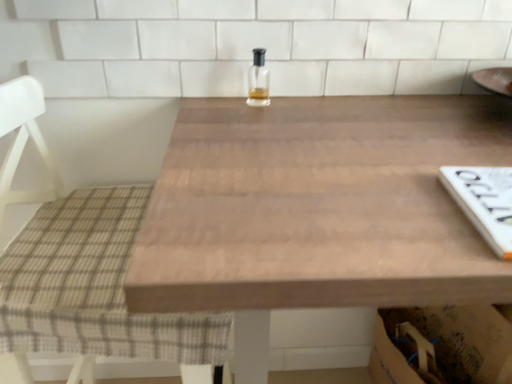
Question: Is wooden table at center facing towards clear glass bottle at center?

Choices:
 (A) yes
 (B) no

Answer: (B)

Question: Is the surface of wooden table at center in direct contact with clear glass bottle at center?

Choices:
 (A) yes
 (B) no

Answer: (B)

Question: Is wooden table at center further to the viewer compared to clear glass bottle at center?

Choices:
 (A) no
 (B) yes

Answer: (A)

Question: Is wooden table at center positioned in front of clear glass bottle at center?

Choices:
 (A) no
 (B) yes

Answer: (B)

Question: From the image's perspective, is wooden table at center below clear glass bottle at center?

Choices:
 (A) yes
 (B) no

Answer: (A)

Question: Does wooden table at center have a lesser height compared to clear glass bottle at center?

Choices:
 (A) yes
 (B) no

Answer: (B)

Question: Does clear glass bottle at center have a lesser width compared to plaid fabric chair at left?

Choices:
 (A) no
 (B) yes

Answer: (B)

Question: Does clear glass bottle at center have a greater width compared to plaid fabric chair at left?

Choices:
 (A) no
 (B) yes

Answer: (A)

Question: From the image's perspective, is clear glass bottle at center on plaid fabric chair at left?

Choices:
 (A) yes
 (B) no

Answer: (A)

Question: Is clear glass bottle at center oriented towards plaid fabric chair at left?

Choices:
 (A) no
 (B) yes

Answer: (A)

Question: Does clear glass bottle at center have a smaller size compared to plaid fabric chair at left?

Choices:
 (A) no
 (B) yes

Answer: (B)

Question: Is clear glass bottle at center taller than plaid fabric chair at left?

Choices:
 (A) yes
 (B) no

Answer: (B)

Question: Is clear glass bottle at center at the left side of wooden table at center?

Choices:
 (A) yes
 (B) no

Answer: (A)